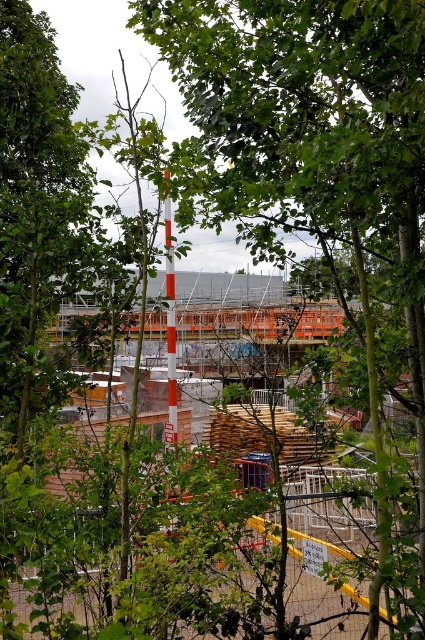
Question: Can you confirm if green leafy tree at center is wider than smooth orange pole at center?

Choices:
 (A) yes
 (B) no

Answer: (B)

Question: Which point is farther to the camera?

Choices:
 (A) smooth orange pole at center
 (B) yellow metal fence at lower center

Answer: (A)

Question: Can you confirm if green leafy tree at center is positioned to the right of yellow metal fence at lower center?

Choices:
 (A) no
 (B) yes

Answer: (B)

Question: Among these points, which one is nearest to the camera?

Choices:
 (A) (172, 634)
 (B) (175, 342)

Answer: (A)

Question: Does green leafy tree at center have a smaller size compared to smooth orange pole at center?

Choices:
 (A) no
 (B) yes

Answer: (B)

Question: Estimate the real-world distances between objects in this image. Which object is farther from the smooth orange pole at center?

Choices:
 (A) green leafy tree at center
 (B) yellow metal fence at lower center

Answer: (B)